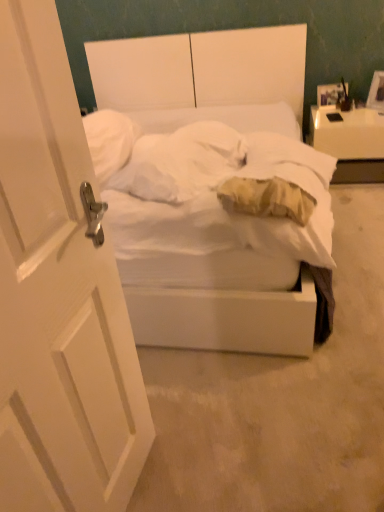
Question: Is white matte bed at center positioned far away from white glossy nightstand at upper right?

Choices:
 (A) yes
 (B) no

Answer: (B)

Question: From the image's perspective, is white matte bed at center over white glossy nightstand at upper right?

Choices:
 (A) no
 (B) yes

Answer: (A)

Question: Does white matte bed at center have a smaller size compared to white glossy nightstand at upper right?

Choices:
 (A) no
 (B) yes

Answer: (A)

Question: Is the position of white matte bed at center less distant than that of white glossy nightstand at upper right?

Choices:
 (A) yes
 (B) no

Answer: (A)

Question: From the image's perspective, is white matte bed at center beneath white glossy nightstand at upper right?

Choices:
 (A) yes
 (B) no

Answer: (A)

Question: In terms of height, does wooden photo frame at upper right look taller or shorter compared to white glossy nightstand at upper right?

Choices:
 (A) tall
 (B) short

Answer: (B)

Question: Considering the positions of point (344, 88) and point (337, 128), is point (344, 88) closer or farther from the camera than point (337, 128)?

Choices:
 (A) farther
 (B) closer

Answer: (A)

Question: Based on their positions, is wooden photo frame at upper right located to the left or right of white glossy nightstand at upper right?

Choices:
 (A) right
 (B) left

Answer: (B)

Question: From the image's perspective, is wooden photo frame at upper right positioned above or below white glossy nightstand at upper right?

Choices:
 (A) below
 (B) above

Answer: (B)

Question: Considering the positions of point (41, 470) and point (327, 94), is point (41, 470) closer or farther from the camera than point (327, 94)?

Choices:
 (A) farther
 (B) closer

Answer: (B)

Question: Relative to wooden photo frame at upper right, is white matte door at left in front or behind?

Choices:
 (A) front
 (B) behind

Answer: (A)

Question: Is white matte door at left inside or outside of wooden photo frame at upper right?

Choices:
 (A) outside
 (B) inside

Answer: (A)

Question: Based on their sizes in the image, would you say white matte door at left is bigger or smaller than wooden photo frame at upper right?

Choices:
 (A) big
 (B) small

Answer: (A)

Question: Looking at the image, does soft yellow pillow at center seem bigger or smaller compared to white matte bed at center?

Choices:
 (A) small
 (B) big

Answer: (A)

Question: From a real-world perspective, is soft yellow pillow at center above or below white matte bed at center?

Choices:
 (A) above
 (B) below

Answer: (A)